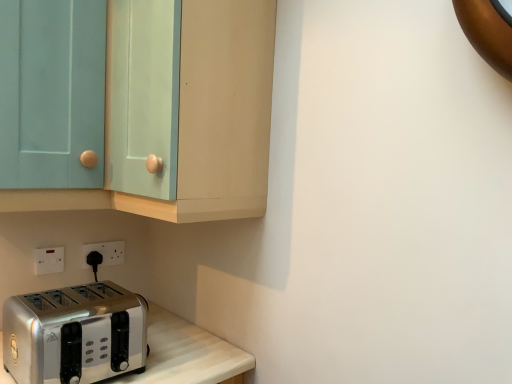
Question: Is light blue glass door at upper left touching satin silver toaster at lower left?

Choices:
 (A) yes
 (B) no

Answer: (B)

Question: Is light blue glass door at upper left to the left of satin silver toaster at lower left from the viewer's perspective?

Choices:
 (A) yes
 (B) no

Answer: (A)

Question: From the image's perspective, does light blue glass door at upper left appear higher than satin silver toaster at lower left?

Choices:
 (A) yes
 (B) no

Answer: (A)

Question: Is light blue glass door at upper left at the right side of satin silver toaster at lower left?

Choices:
 (A) yes
 (B) no

Answer: (B)

Question: Can we say light blue glass door at upper left lies outside satin silver toaster at lower left?

Choices:
 (A) no
 (B) yes

Answer: (B)

Question: Is light blue glass door at upper left not close to satin silver toaster at lower left?

Choices:
 (A) no
 (B) yes

Answer: (A)

Question: Is white plastic electric outlet at lower left, arranged as the second electric outlet when viewed from the right, oriented away from matte teal cabinet at upper left?

Choices:
 (A) yes
 (B) no

Answer: (B)

Question: Is matte teal cabinet at upper left located within white plastic electric outlet at lower left, marked as the first electric outlet in a left-to-right arrangement?

Choices:
 (A) no
 (B) yes

Answer: (A)

Question: Is white plastic electric outlet at lower left, arranged as the second electric outlet when viewed from the right, with matte teal cabinet at upper left?

Choices:
 (A) no
 (B) yes

Answer: (A)

Question: Is white plastic electric outlet at lower left, arranged as the second electric outlet when viewed from the right, taller than matte teal cabinet at upper left?

Choices:
 (A) yes
 (B) no

Answer: (B)

Question: From a real-world perspective, is white plastic electric outlet at lower left, marked as the first electric outlet in a left-to-right arrangement, located higher than matte teal cabinet at upper left?

Choices:
 (A) yes
 (B) no

Answer: (B)

Question: From the image's perspective, is white plastic electric outlet at lower left, arranged as the second electric outlet when viewed from the right, beneath matte teal cabinet at upper left?

Choices:
 (A) no
 (B) yes

Answer: (B)

Question: Can you confirm if matte teal cabinet at upper left is shorter than white plastic electric outlet at lower left, placed as the second electric outlet when sorted from front to back?

Choices:
 (A) yes
 (B) no

Answer: (B)